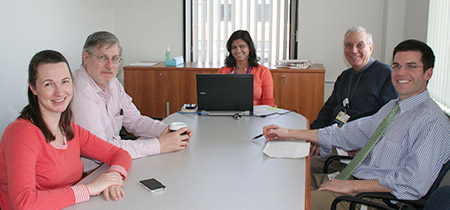
The height and width of the screenshot is (210, 450). Find the location of `pen`. pen is located at coordinates (257, 135).